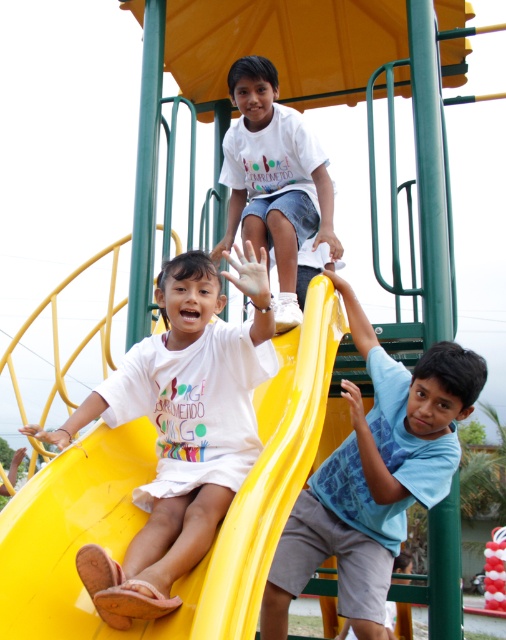
Question: Is yellow plastic slide at center to the right of white cotton shirt at upper center from the viewer's perspective?

Choices:
 (A) no
 (B) yes

Answer: (B)

Question: Which point is closer to the camera?

Choices:
 (A) blue printed shirt at upper right
 (B) white cotton shirt at upper center

Answer: (B)

Question: Can you confirm if blue printed shirt at upper right is smaller than white cotton shirt at upper center?

Choices:
 (A) yes
 (B) no

Answer: (A)

Question: Observing the image, what is the correct spatial positioning of blue printed shirt at upper right in reference to white cotton shirt at upper center?

Choices:
 (A) left
 (B) right

Answer: (B)

Question: Which point appears farthest from the camera in this image?

Choices:
 (A) (288, 204)
 (B) (257, 605)
 (C) (440, 353)

Answer: (A)

Question: Which is nearer to the blue printed shirt at upper right?

Choices:
 (A) yellow plastic slide at center
 (B) white cotton shirt at upper center

Answer: (A)